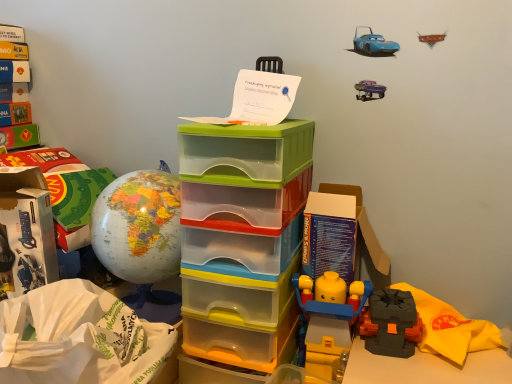
Question: Which direction should I rotate to look at translucent plastic storage box at center, arranged as the 1th storage box when viewed from the right?

Choices:
 (A) right
 (B) left

Answer: (B)

Question: Is matte globe at left at the back of white cardboard box at left, which is the first storage box from left to right?

Choices:
 (A) yes
 (B) no

Answer: (B)

Question: Does white cardboard box at left, marked as the second storage box in a right-to-left arrangement, have a lesser height compared to matte globe at left?

Choices:
 (A) yes
 (B) no

Answer: (B)

Question: Is white cardboard box at left, marked as the second storage box in a right-to-left arrangement, positioned in front of matte globe at left?

Choices:
 (A) yes
 (B) no

Answer: (B)

Question: Is white cardboard box at left, which is the first storage box from left to right, outside of matte globe at left?

Choices:
 (A) no
 (B) yes

Answer: (B)

Question: Does white cardboard box at left, which is the first storage box from left to right, have a smaller size compared to matte globe at left?

Choices:
 (A) no
 (B) yes

Answer: (B)

Question: Is white cardboard box at left, which is the first storage box from left to right, facing towards matte globe at left?

Choices:
 (A) yes
 (B) no

Answer: (B)

Question: Does white paper bag at lower left appear on the right side of matte black lego piece at lower right?

Choices:
 (A) no
 (B) yes

Answer: (A)

Question: Can matte black lego piece at lower right be found inside white paper bag at lower left?

Choices:
 (A) yes
 (B) no

Answer: (B)

Question: Could you tell me if white paper bag at lower left is facing matte black lego piece at lower right?

Choices:
 (A) no
 (B) yes

Answer: (A)

Question: Is white paper bag at lower left completely or partially outside of matte black lego piece at lower right?

Choices:
 (A) no
 (B) yes

Answer: (B)

Question: Is white paper bag at lower left further to the viewer compared to matte black lego piece at lower right?

Choices:
 (A) no
 (B) yes

Answer: (A)

Question: Can you confirm if white paper bag at lower left is smaller than matte black lego piece at lower right?

Choices:
 (A) yes
 (B) no

Answer: (B)

Question: Does matte black lego piece at lower right have a greater width compared to translucent plastic storage box at center, positioned as the 2th storage box in left-to-right order?

Choices:
 (A) no
 (B) yes

Answer: (A)